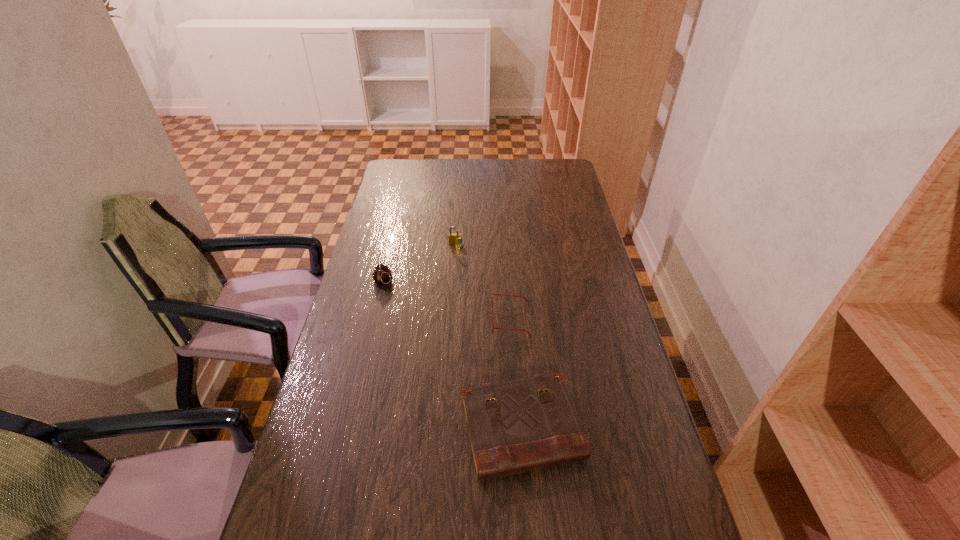
You are a GUI agent. You are given a task and a screenshot of the screen. Output one action in this format:
    pyautogui.click(x=<x>, y=<y>)
    Task: Click on the vacant space located on the face of the shortest object
    
    Given the screenshot: What is the action you would take?
    pyautogui.click(x=450, y=319)

You are a GUI agent. You are given a task and a screenshot of the screen. Output one action in this format:
    pyautogui.click(x=<x>, y=<y>)
    Task: Click on the vacant space located on the face of the shortest object
    
    Given the screenshot: What is the action you would take?
    pyautogui.click(x=380, y=319)

Locate an element on the screen. The image size is (960, 540). vacant space located 0.200m on the face of the shortest object is located at coordinates (428, 319).

Identify the location of object present at the left edge. This screenshot has height=540, width=960. (382, 275).

Find the location of a particular element. free space at the far edge is located at coordinates (494, 172).

You are a GUI agent. You are given a task and a screenshot of the screen. Output one action in this format:
    pyautogui.click(x=<x>, y=<y>)
    Task: Click on the vacant space at the left edge of the desktop
    This screenshot has height=540, width=960.
    Given the screenshot: What is the action you would take?
    pyautogui.click(x=382, y=199)

Where is `vacant region at the right edge of the desktop`? The height and width of the screenshot is (540, 960). vacant region at the right edge of the desktop is located at coordinates (580, 300).

The image size is (960, 540). Find the location of `vacant space at the far left corner`. vacant space at the far left corner is located at coordinates (401, 164).

Locate an element on the screen. Image resolution: width=960 pixels, height=540 pixels. free point at the far right corner is located at coordinates (564, 180).

Find the location of a particular element. free space between the second nearest object and the nearest object is located at coordinates (516, 374).